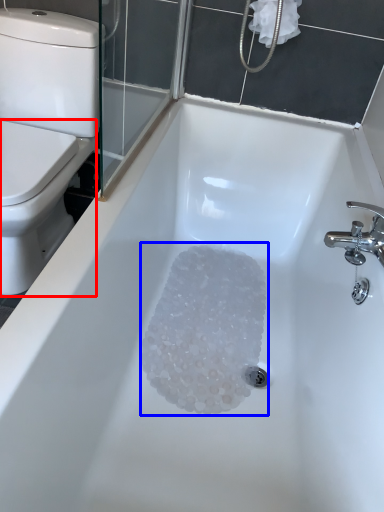
Question: Which object appears closest to the camera in this image, bidet (highlighted by a red box) or crystal (highlighted by a blue box)?

Choices:
 (A) bidet
 (B) crystal

Answer: (A)